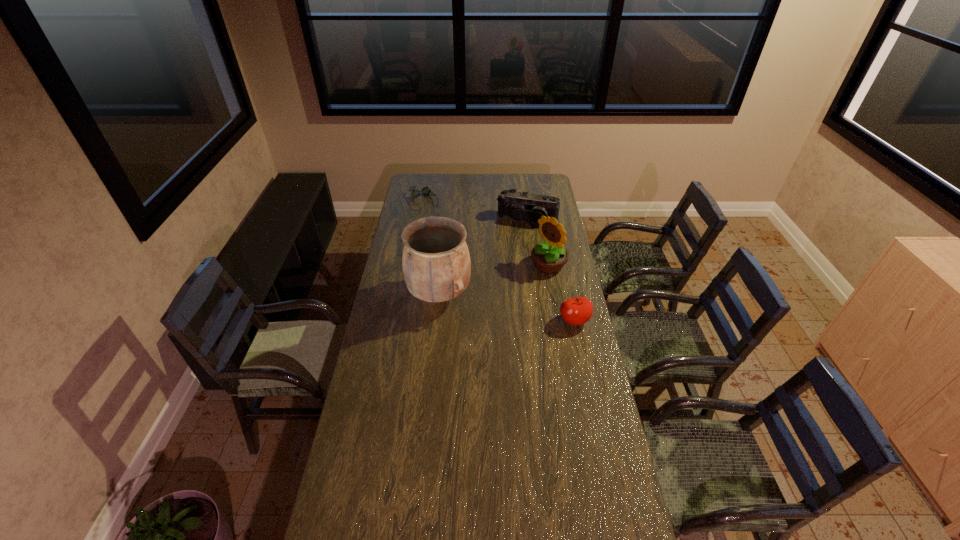
You are a GUI agent. You are given a task and a screenshot of the screen. Output one action in this format:
    pyautogui.click(x=<x>, y=<y>)
    Task: Click on the free space on the desktop that is between the urn and the apple and is positioned on the front-facing side of the camcorder
    This screenshot has width=960, height=540.
    Given the screenshot: What is the action you would take?
    pyautogui.click(x=495, y=305)

This screenshot has width=960, height=540. What are the coordinates of `free space on the desktop that is between the tallest object and the apple and is positioned on the face of the sunflower` in the screenshot? It's located at (487, 303).

Find the location of a particular element. The image size is (960, 540). free space on the desktop that is between the urn and the apple and is positioned on the front-facing side of the shortest object is located at coordinates (492, 305).